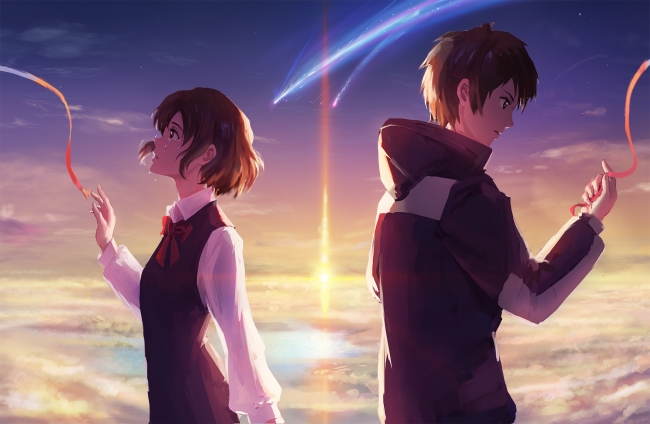
Where is `light`? light is located at coordinates (318, 282).